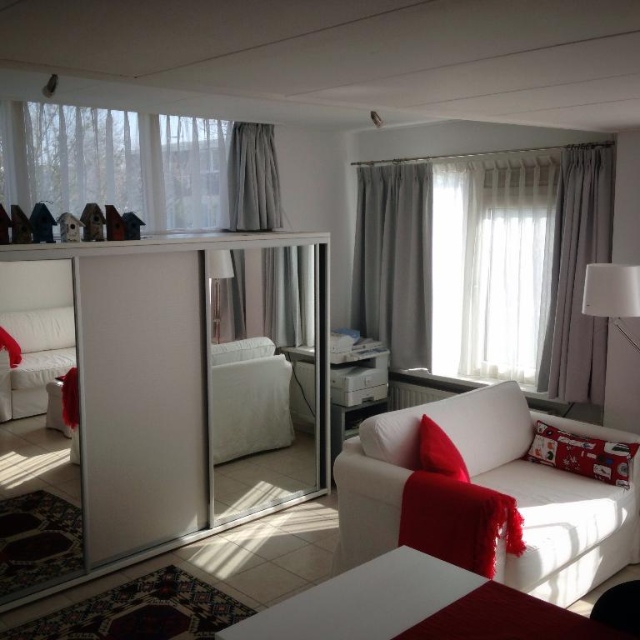
You are standing at the point (192,438) and want to walk to the sofa. The room is 15 feet long. Can you reach the sofa without crossing the 15 feet distance?

The distance between you and the sofa is 12.01 feet, which is less than the 15 feet length of the room. Therefore, you can reach the sofa without crossing the 15 feet distance.

You are planning to hang a new picture frame on the wall between the gray fabric curtain at center and the satin red pillow at lower right. The frame is 1 meter wide. Can the space between them accommodate the frame?

The gray fabric curtain at center might be wider than the satin red pillow at lower right, so the space between them may be sufficient to fit the 1 meter wide picture frame. However, since the exact width difference isn not specified, it is recommended to measure the space before hanging the frame to ensure it fits properly.

You are standing in the living room and want to move from the gray velvet curtain at center to the white fabric couch at lower right. Which direction should you move to reach it?

You should move to the right to reach the white fabric couch at lower right since it is located to the right of the gray velvet curtain at center.